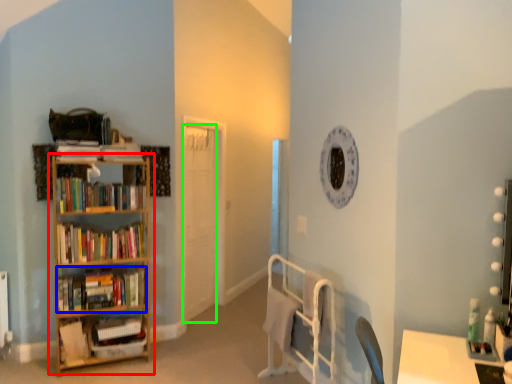
Question: Which object is positioned farthest from shelf (highlighted by a red box)? Select from book (highlighted by a blue box) and door (highlighted by a green box).

Choices:
 (A) book
 (B) door

Answer: (B)